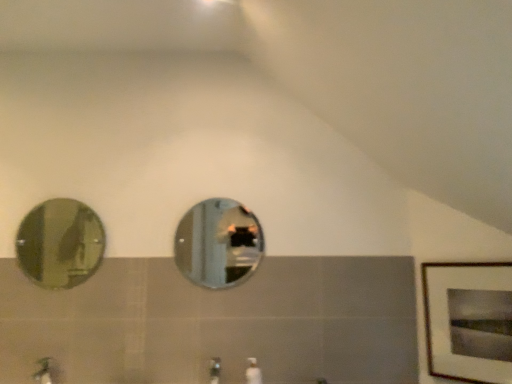
I want to click on green glass mirror at left, which is counted as the 2th mirror, starting from the right, so click(60, 243).

Locate an element on the screen. The width and height of the screenshot is (512, 384). green matte faucet at lower left, positioned as the 2th faucet in right-to-left order is located at coordinates (42, 371).

Measure the distance between point (255, 359) and camera.

The depth of point (255, 359) is 6.82 feet.

At what (x,y) coordinates should I click in order to perform the action: click on green glass mirror at left, which is counted as the 2th mirror, starting from the right. Please return your answer as a coordinate pair (x, y). The image size is (512, 384). Looking at the image, I should click on [x=60, y=243].

At what (x,y) coordinates should I click in order to perform the action: click on the 1st faucet below when counting from the green glass mirror at left, which is counted as the 2th mirror, starting from the right (from the image's perspective). Please return your answer as a coordinate pair (x, y). The width and height of the screenshot is (512, 384). Looking at the image, I should click on (215, 370).

Are green glass mirror at left, which is counted as the 2th mirror, starting from the right, and brushed metal faucet at lower center, the 2th faucet positioned from the left, far apart?

That's right, there is a large distance between green glass mirror at left, which is counted as the 2th mirror, starting from the right, and brushed metal faucet at lower center, the 2th faucet positioned from the left.

Can you confirm if green glass mirror at left, which is counted as the 2th mirror, starting from the right, is positioned to the right of brushed metal faucet at lower center, the 2th faucet positioned from the left?

No, green glass mirror at left, which is counted as the 2th mirror, starting from the right, is not to the right of brushed metal faucet at lower center, the 2th faucet positioned from the left.

In terms of width, does green glass mirror at left, which is counted as the 2th mirror, starting from the right, look wider or thinner when compared to brushed metal faucet at lower center, the first faucet viewed from the right?

Considering their sizes, green glass mirror at left, which is counted as the 2th mirror, starting from the right, looks slimmer than brushed metal faucet at lower center, the first faucet viewed from the right.

From the image's perspective, which mirror is the 1st one above the brushed metal faucet at lower center, the first faucet viewed from the right? Please provide its 2D coordinates.

[(218, 244)]

Based on the photo, who is shorter, silver reflective mirror at center, the second mirror from the left, or brushed metal faucet at lower center, the first faucet viewed from the right?

brushed metal faucet at lower center, the first faucet viewed from the right, is shorter.

From a real-world perspective, which object stands above the other?

From a 3D spatial view, silver reflective mirror at center, the second mirror from the left, is above.

Considering the points (186, 224) and (212, 375), which point is behind, point (186, 224) or point (212, 375)?

The point (186, 224) is more distant.

From a real-world perspective, is brushed metal faucet at lower center, the first faucet viewed from the right, physically located above or below green matte faucet at lower left, positioned as the 2th faucet in right-to-left order?

brushed metal faucet at lower center, the first faucet viewed from the right, is situated lower than green matte faucet at lower left, positioned as the 2th faucet in right-to-left order, in the real world.

Between point (212, 372) and point (50, 381), which one is positioned in front?

The point (50, 381) is more forward.

Is brushed metal faucet at lower center, the 2th faucet positioned from the left, wider or thinner than green matte faucet at lower left, which appears as the 1th faucet when viewed from the left?

Clearly, brushed metal faucet at lower center, the 2th faucet positioned from the left, has less width compared to green matte faucet at lower left, which appears as the 1th faucet when viewed from the left.

Based on the photo, in the image, is brushed metal faucet at lower center, the first faucet viewed from the right, positioned in front of or behind green matte faucet at lower left, positioned as the 2th faucet in right-to-left order?

brushed metal faucet at lower center, the first faucet viewed from the right, is behind green matte faucet at lower left, positioned as the 2th faucet in right-to-left order.

Is wooden framed print at right outside of silver reflective mirror at center, the 1th mirror when ordered from right to left?

That's correct, wooden framed print at right is outside of silver reflective mirror at center, the 1th mirror when ordered from right to left.

Can you confirm if wooden framed print at right is thinner than silver reflective mirror at center, the 1th mirror when ordered from right to left?

Incorrect, the width of wooden framed print at right is not less than that of silver reflective mirror at center, the 1th mirror when ordered from right to left.

From a real-world perspective, is wooden framed print at right physically located above or below silver reflective mirror at center, the second mirror from the left?

From a real-world perspective, wooden framed print at right is physically below silver reflective mirror at center, the second mirror from the left.

In the scene shown: Can you confirm if wooden framed print at right is smaller than silver reflective mirror at center, the second mirror from the left?

Incorrect, wooden framed print at right is not smaller in size than silver reflective mirror at center, the second mirror from the left.

From a real-world perspective, which object rests below the other?

white glossy soap dispenser at center.

Considering the sizes of objects green glass mirror at left, acting as the 1th mirror starting from the left, and white glossy soap dispenser at center in the image provided, who is shorter, green glass mirror at left, acting as the 1th mirror starting from the left, or white glossy soap dispenser at center?

Standing shorter between the two is white glossy soap dispenser at center.

From the image's perspective, is green glass mirror at left, which is counted as the 2th mirror, starting from the right, below white glossy soap dispenser at center?

No, from the image's perspective, green glass mirror at left, which is counted as the 2th mirror, starting from the right, is not below white glossy soap dispenser at center.

Considering the sizes of objects green glass mirror at left, which is counted as the 2th mirror, starting from the right, and white glossy soap dispenser at center in the image provided, who is thinner, green glass mirror at left, which is counted as the 2th mirror, starting from the right, or white glossy soap dispenser at center?

green glass mirror at left, which is counted as the 2th mirror, starting from the right, is thinner.

Is the depth of brushed metal faucet at lower center, the 2th faucet positioned from the left, less than that of white glossy soap dispenser at center?

Yes, the depth of brushed metal faucet at lower center, the 2th faucet positioned from the left, is less than that of white glossy soap dispenser at center.

Which is more to the right, brushed metal faucet at lower center, the first faucet viewed from the right, or white glossy soap dispenser at center?

white glossy soap dispenser at center.

This screenshot has height=384, width=512. There is a white glossy soap dispenser at center. Find the location of `the 1st faucet below it (from the image's perspective)`. the 1st faucet below it (from the image's perspective) is located at coordinates (215, 370).

Could you measure the distance between brushed metal faucet at lower center, the 2th faucet positioned from the left, and white glossy soap dispenser at center?

The distance of brushed metal faucet at lower center, the 2th faucet positioned from the left, from white glossy soap dispenser at center is 6.20 inches.

Considering the sizes of objects wooden framed print at right and green glass mirror at left, which is counted as the 2th mirror, starting from the right, in the image provided, who is bigger, wooden framed print at right or green glass mirror at left, which is counted as the 2th mirror, starting from the right,?

With larger size is wooden framed print at right.

Which object is further away from the camera taking this photo, wooden framed print at right or green glass mirror at left, acting as the 1th mirror starting from the left?

green glass mirror at left, acting as the 1th mirror starting from the left, is further away from the camera.

Locate an element on the screen. picture frame in front of the green glass mirror at left, acting as the 1th mirror starting from the left is located at coordinates (465, 316).

Which is farther from the camera, (429, 306) or (74, 234)?

The point (74, 234) is more distant.

In order to click on mirror on the left of brushed metal faucet at lower center, the first faucet viewed from the right in this screenshot , I will do `click(60, 243)`.

From a real-world perspective, count 1st mirrors upward from the brushed metal faucet at lower center, the first faucet viewed from the right, and point to it. Please provide its 2D coordinates.

[(218, 244)]

From the image, which object appears to be nearer to wooden framed print at right, brushed metal faucet at lower center, the 2th faucet positioned from the left, or white glossy soap dispenser at center?

white glossy soap dispenser at center lies closer to wooden framed print at right than the other object.

When comparing their distances from green glass mirror at left, which is counted as the 2th mirror, starting from the right, does white glossy soap dispenser at center or wooden framed print at right seem closer?

white glossy soap dispenser at center is positioned closer to the anchor green glass mirror at left, which is counted as the 2th mirror, starting from the right.

Looking at the image, which one is located further to white glossy soap dispenser at center, wooden framed print at right or green matte faucet at lower left, which appears as the 1th faucet when viewed from the left?

Among the two, green matte faucet at lower left, which appears as the 1th faucet when viewed from the left, is located further to white glossy soap dispenser at center.

Looking at the image, which one is located closer to white glossy soap dispenser at center, brushed metal faucet at lower center, the first faucet viewed from the right, or silver reflective mirror at center, the 1th mirror when ordered from right to left?

brushed metal faucet at lower center, the first faucet viewed from the right, is closer to white glossy soap dispenser at center.

When comparing their distances from green matte faucet at lower left, which appears as the 1th faucet when viewed from the left, does green glass mirror at left, which is counted as the 2th mirror, starting from the right, or wooden framed print at right seem closer?

wooden framed print at right is positioned closer to the anchor green matte faucet at lower left, which appears as the 1th faucet when viewed from the left.

Consider the image. Considering their positions, is brushed metal faucet at lower center, the first faucet viewed from the right, positioned further to silver reflective mirror at center, the second mirror from the left, than green matte faucet at lower left, which appears as the 1th faucet when viewed from the left?

The object further to silver reflective mirror at center, the second mirror from the left, is green matte faucet at lower left, which appears as the 1th faucet when viewed from the left.

Estimate the real-world distances between objects in this image. Which object is closer to silver reflective mirror at center, the second mirror from the left, white glossy soap dispenser at center or wooden framed print at right?

white glossy soap dispenser at center lies closer to silver reflective mirror at center, the second mirror from the left, than the other object.

Which object lies further to the anchor point white glossy soap dispenser at center, brushed metal faucet at lower center, the first faucet viewed from the right, or wooden framed print at right?

wooden framed print at right is positioned further to the anchor white glossy soap dispenser at center.

Identify the location of mirror between green glass mirror at left, acting as the 1th mirror starting from the left, and wooden framed print at right from left to right. The image size is (512, 384). (218, 244).

You are a GUI agent. You are given a task and a screenshot of the screen. Output one action in this format:
    pyautogui.click(x=<x>, y=<y>)
    Task: Click on the mirror situated between brushed metal faucet at lower center, the first faucet viewed from the right, and wooden framed print at right from left to right
    The image size is (512, 384).
    Given the screenshot: What is the action you would take?
    pyautogui.click(x=218, y=244)

Locate an element on the screen. This screenshot has height=384, width=512. faucet between green matte faucet at lower left, which appears as the 1th faucet when viewed from the left, and silver reflective mirror at center, the 1th mirror when ordered from right to left, in the horizontal direction is located at coordinates (215, 370).

At what (x,y) coordinates should I click in order to perform the action: click on toiletry between green matte faucet at lower left, positioned as the 2th faucet in right-to-left order, and wooden framed print at right. Please return your answer as a coordinate pair (x, y). Looking at the image, I should click on (253, 372).